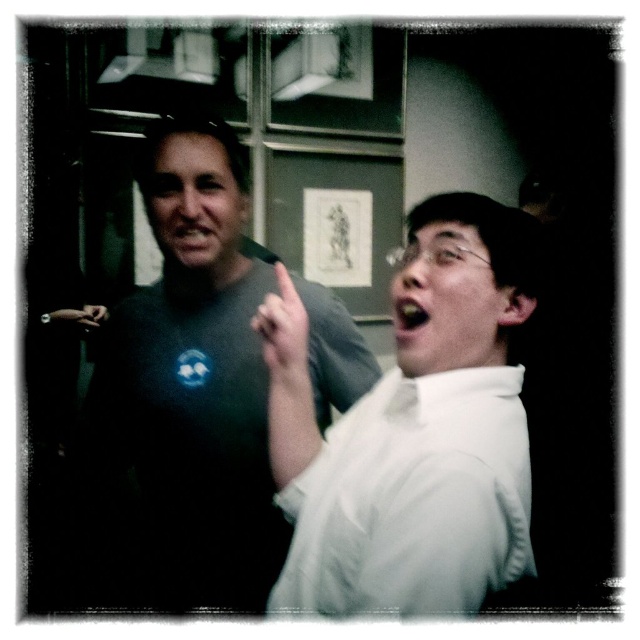
You are standing in the room and see two points marked in the image. Which point is closer to you, point (x=285, y=307) or point (x=396, y=316)?

Point (x=285, y=307) is closer to you because it is further to the viewer than point (x=396, y=316).